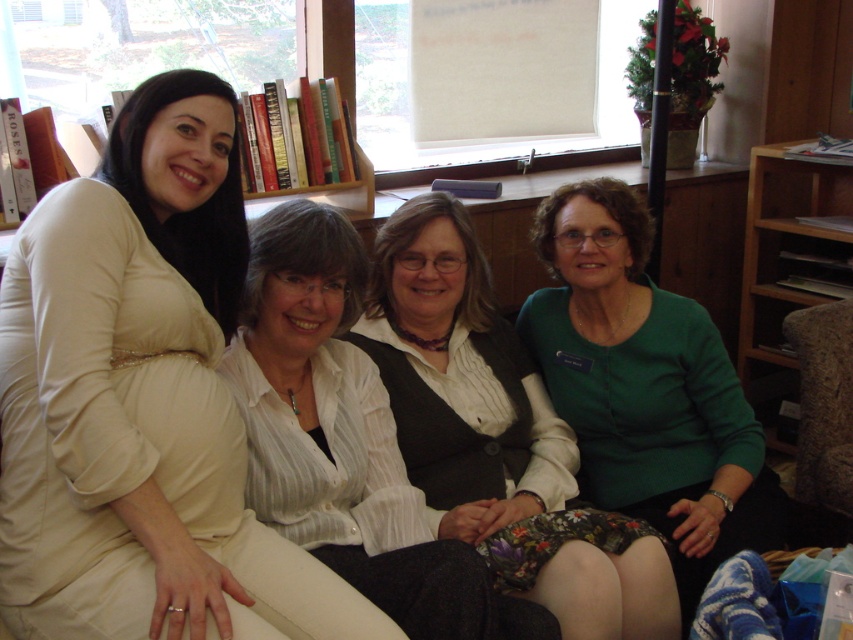
Is matte white blouse at upper left behind green matte sweater at center?

No, it is not.

Which of these two, matte white blouse at upper left or green matte sweater at center, stands taller?

matte white blouse at upper left is taller.

Is point (210, 557) positioned in front of point (512, 522)?

That is True.

Locate an element on the screen. The image size is (853, 640). matte white blouse at upper left is located at coordinates (142, 401).

Locate an element on the screen. The height and width of the screenshot is (640, 853). white striped shirt at center is located at coordinates (345, 438).

Does white striped shirt at center appear over brown wooden bookshelf at right?

No.

You are a GUI agent. You are given a task and a screenshot of the screen. Output one action in this format:
    pyautogui.click(x=<x>, y=<y>)
    Task: Click on the white striped shirt at center
    The height and width of the screenshot is (640, 853).
    Given the screenshot: What is the action you would take?
    pyautogui.click(x=345, y=438)

Find the location of a particular element. green matte sweater at center is located at coordinates tap(497, 435).

Where is `green matte sweater at center`? The width and height of the screenshot is (853, 640). green matte sweater at center is located at coordinates (497, 435).